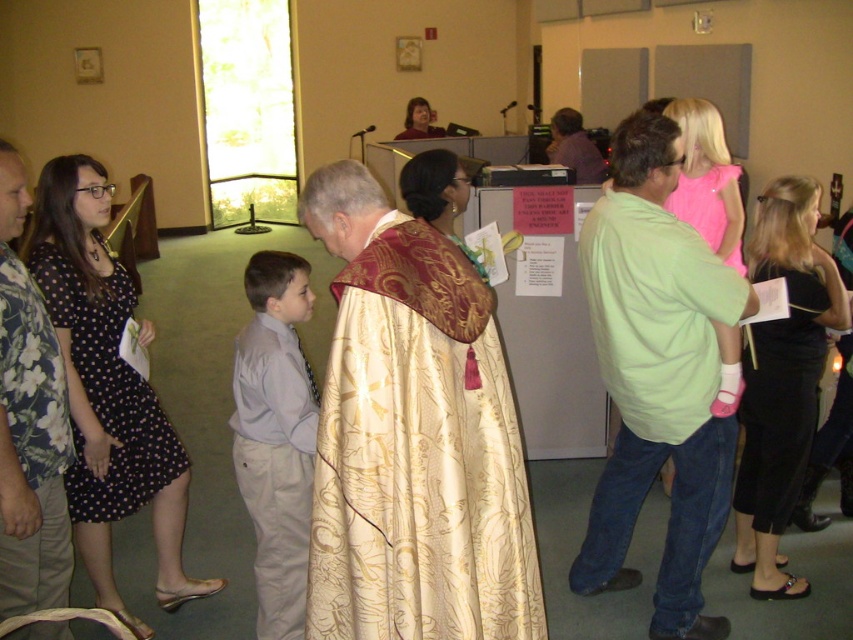
Question: Is light green cotton shirt at center smaller than gold brocade robe at center?

Choices:
 (A) yes
 (B) no

Answer: (B)

Question: Can you confirm if black dotted dress at left is positioned to the left of matte purple shirt at center?

Choices:
 (A) no
 (B) yes

Answer: (B)

Question: Which of the following is the farthest from the observer?

Choices:
 (A) (734, 324)
 (B) (71, 300)
 (C) (405, 116)

Answer: (C)

Question: Which of the following is the closest to the observer?

Choices:
 (A) (424, 100)
 (B) (759, 401)

Answer: (B)

Question: Can you confirm if black dotted dress at left is positioned above matte purple shirt at center?

Choices:
 (A) no
 (B) yes

Answer: (A)

Question: Which point is farther to the camera?

Choices:
 (A) (105, 488)
 (B) (840, 317)
 (C) (328, 483)

Answer: (B)